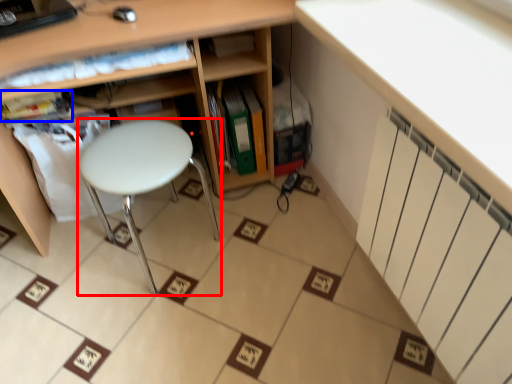
Question: Which object appears closest to the camera in this image, stool (highlighted by a red box) or book (highlighted by a blue box)?

Choices:
 (A) stool
 (B) book

Answer: (A)